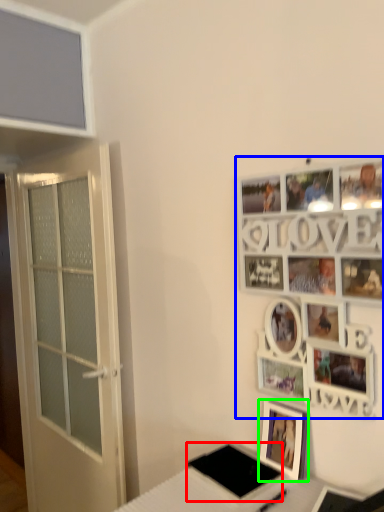
Question: Which object is positioned farthest from pad (highlighted by a red box)? Select from picture frame (highlighted by a blue box) and picture frame (highlighted by a green box).

Choices:
 (A) picture frame
 (B) picture frame

Answer: (A)